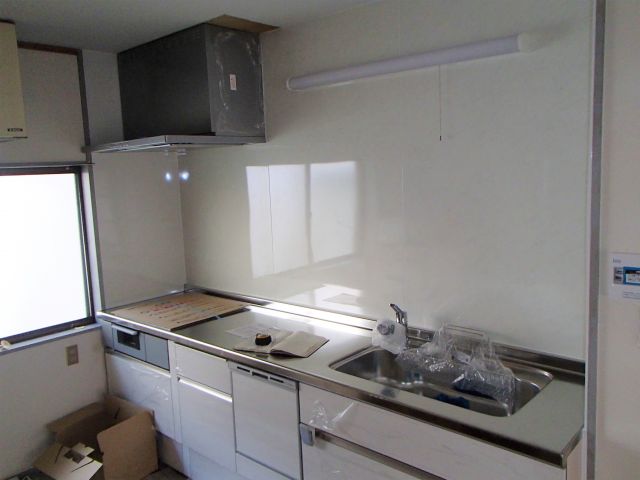
Identify the location of sink faucet. The width and height of the screenshot is (640, 480). (400, 318), (481, 355).